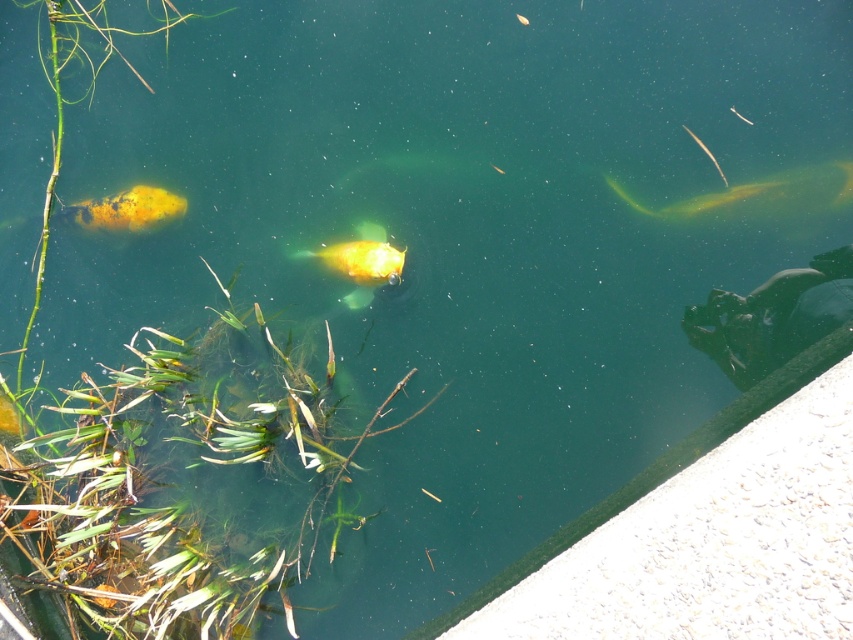
Question: Which point is closer to the camera?

Choices:
 (A) translucent yellowish-green fish at upper right
 (B) translucent yellow fish at upper right
 (C) shiny orange fish at left

Answer: (A)

Question: Does translucent yellowish-green fish at upper right have a greater width compared to translucent yellow fish at upper right?

Choices:
 (A) no
 (B) yes

Answer: (B)

Question: Considering the relative positions of translucent yellowish-green fish at upper right and shiny gold fish at center in the image provided, where is translucent yellowish-green fish at upper right located with respect to shiny gold fish at center?

Choices:
 (A) below
 (B) above

Answer: (B)

Question: Which is nearer to the translucent yellowish-green fish at upper right?

Choices:
 (A) translucent yellow fish at upper right
 (B) shiny gold fish at center

Answer: (A)

Question: Which point is farther to the camera?

Choices:
 (A) translucent yellowish-green fish at upper right
 (B) translucent yellow fish at upper right
 (C) shiny gold fish at center
 (D) shiny orange fish at left

Answer: (D)

Question: Does translucent yellowish-green fish at upper right appear under shiny orange fish at left?

Choices:
 (A) no
 (B) yes

Answer: (A)